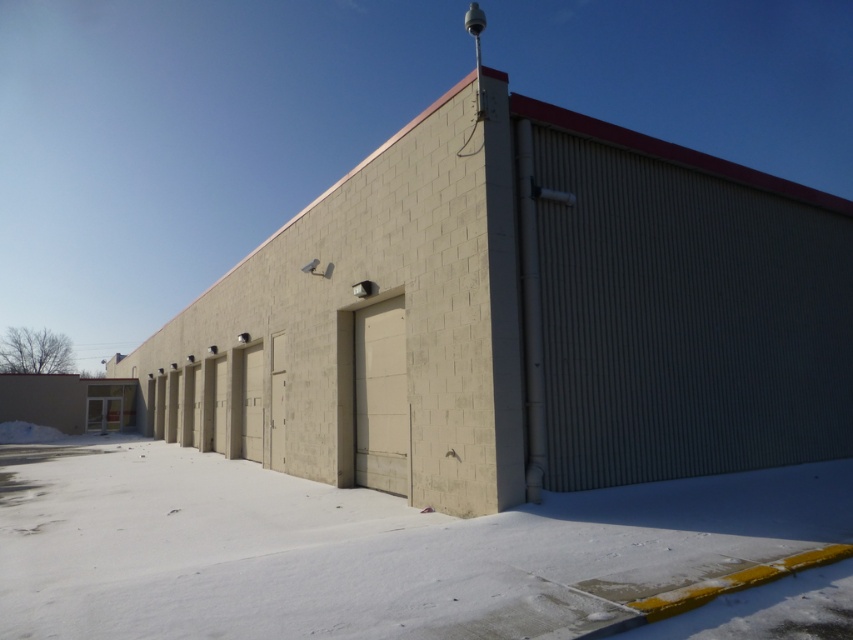
Is white powdery snow at lower center above gray corrugated metal at right?

No, white powdery snow at lower center is not above gray corrugated metal at right.

Is white powdery snow at lower center wider than gray corrugated metal at right?

Indeed, white powdery snow at lower center has a greater width compared to gray corrugated metal at right.

Is point (519, 522) closer to camera compared to point (548, 413)?

Yes, point (519, 522) is closer to viewer.

The image size is (853, 640). What are the coordinates of `white powdery snow at lower center` in the screenshot? It's located at (363, 548).